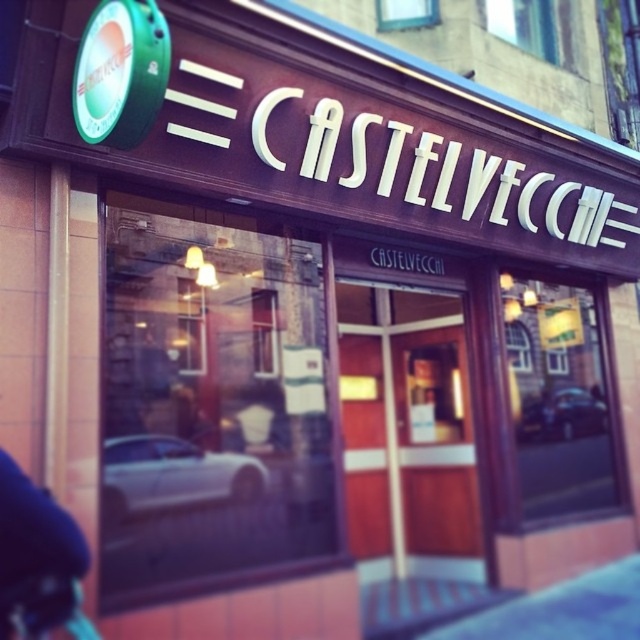
Question: Is white glossy car at lower left bigger than shiny silver car at center?

Choices:
 (A) no
 (B) yes

Answer: (A)

Question: Which object appears closest to the camera in this image?

Choices:
 (A) white glossy car at lower left
 (B) shiny silver car at center

Answer: (A)

Question: Is white glossy car at lower left behind shiny silver car at center?

Choices:
 (A) yes
 (B) no

Answer: (B)

Question: Which point is farther from the camera taking this photo?

Choices:
 (A) (584, 392)
 (B) (147, 488)

Answer: (A)

Question: Is the position of white glossy car at lower left more distant than that of shiny silver car at center?

Choices:
 (A) yes
 (B) no

Answer: (B)